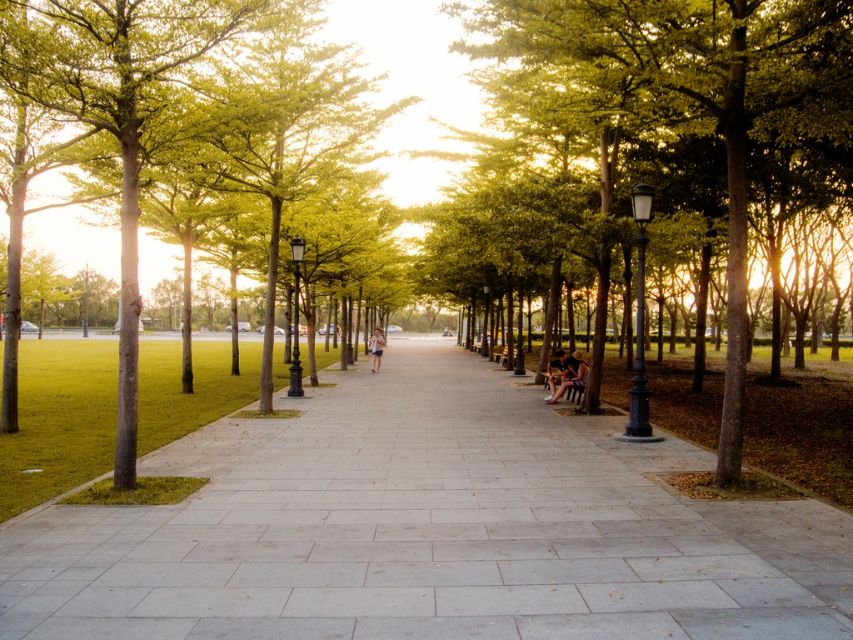
Does gray concrete pavement at center have a lesser width compared to green leafy tree at center?

Indeed, gray concrete pavement at center has a lesser width compared to green leafy tree at center.

Is point (727, 586) in front of point (778, 291)?

Yes, it is in front of point (778, 291).

Find the location of `gray concrete pavement at center`. gray concrete pavement at center is located at coordinates (427, 529).